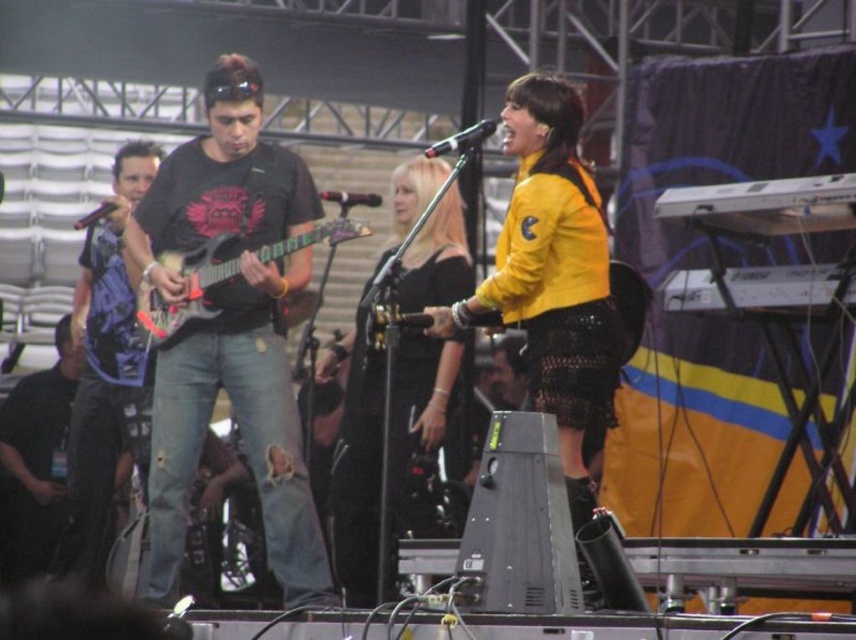
Question: Which object is farther from the camera taking this photo?

Choices:
 (A) metallic electric guitar at center-left
 (B) ripped denim jeans at left
 (C) black matte shirt at lower left

Answer: (C)

Question: Is brushed metal guitar at left positioned before metallic electric guitar at center-left?

Choices:
 (A) yes
 (B) no

Answer: (B)

Question: Is black leather dress at center wider than black matte microphone at upper center?

Choices:
 (A) no
 (B) yes

Answer: (B)

Question: Which point is farther from the camera taking this photo?

Choices:
 (A) (156, 428)
 (B) (94, 221)
 (C) (149, 342)

Answer: (B)

Question: Which of the following is the closest to the observer?

Choices:
 (A) (355, 200)
 (B) (441, 147)
 (C) (156, 234)

Answer: (B)

Question: Does yellow matte jacket at center have a lesser width compared to black leather dress at center?

Choices:
 (A) no
 (B) yes

Answer: (B)